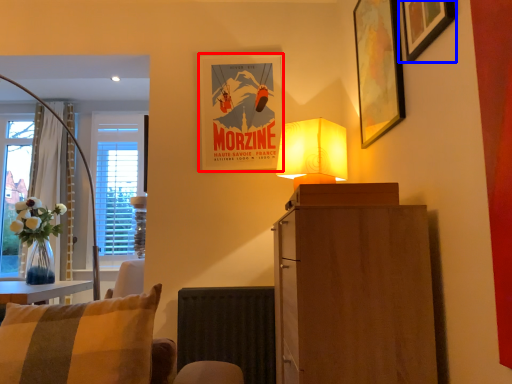
Question: Which of the following is the farthest to the observer, picture frame (highlighted by a red box) or picture frame (highlighted by a blue box)?

Choices:
 (A) picture frame
 (B) picture frame

Answer: (A)